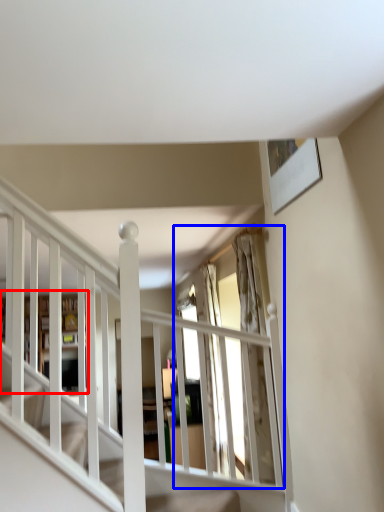
Question: Which object appears farthest to the camera in this image, bookshelf (highlighted by a red box) or window (highlighted by a blue box)?

Choices:
 (A) bookshelf
 (B) window

Answer: (A)